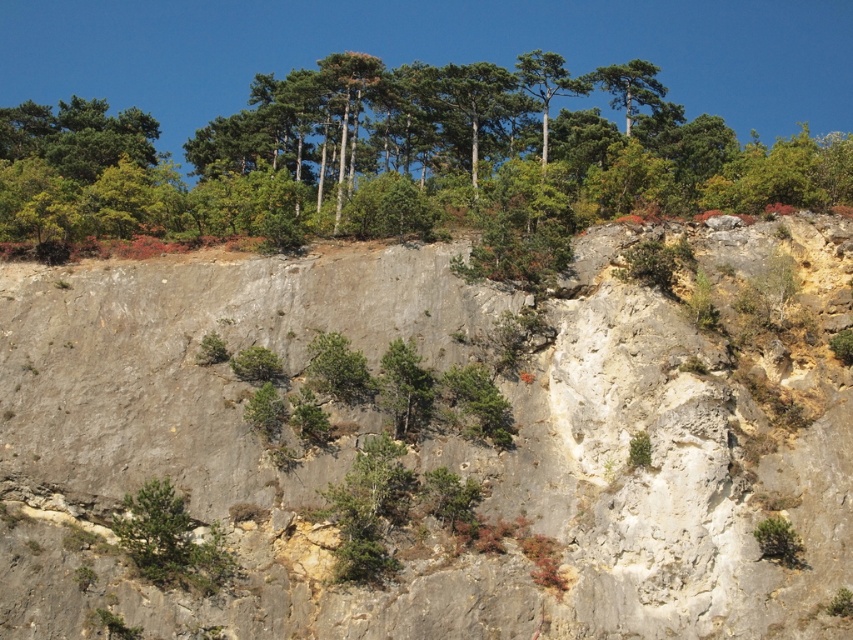
Who is shorter, gray rock at center or green leafy trees at upper center?

Standing shorter between the two is gray rock at center.

Can you confirm if gray rock at center is positioned to the left of green leafy trees at upper center?

Correct, you'll find gray rock at center to the left of green leafy trees at upper center.

Where is `gray rock at center`? This screenshot has height=640, width=853. gray rock at center is located at coordinates (436, 442).

Is point (613, 298) behind point (212, 566)?

Yes, point (613, 298) is farther from viewer.

Who is shorter, gray rock at center or green leafy shrub at lower left?

With less height is green leafy shrub at lower left.

Where is `gray rock at center`? gray rock at center is located at coordinates (436, 442).

Who is lower down, green leafy trees at upper center or green leafy shrub at lower left?

Positioned lower is green leafy shrub at lower left.

Between green leafy trees at upper center and green leafy shrub at lower left, which one has more height?

With more height is green leafy trees at upper center.

Where is `green leafy trees at upper center`? green leafy trees at upper center is located at coordinates (407, 161).